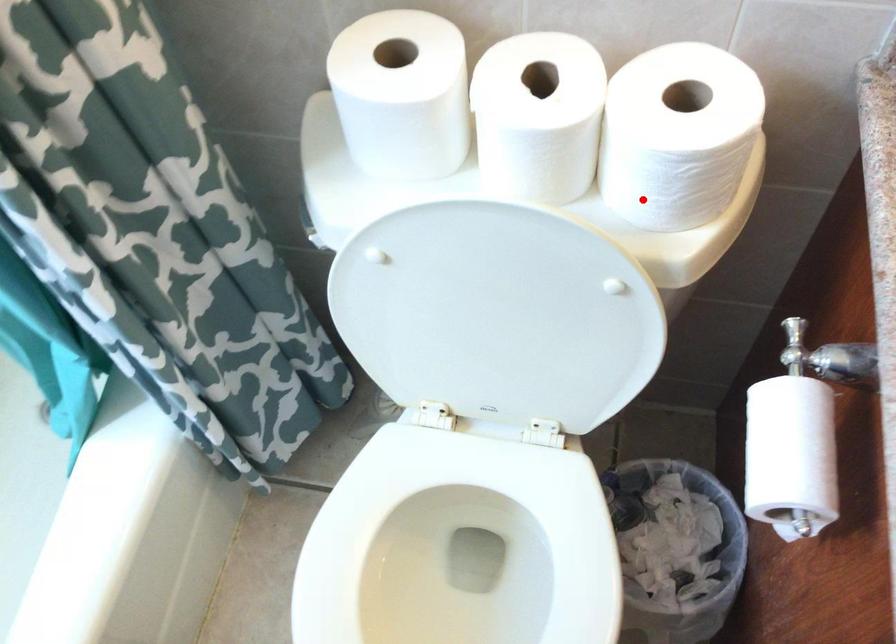
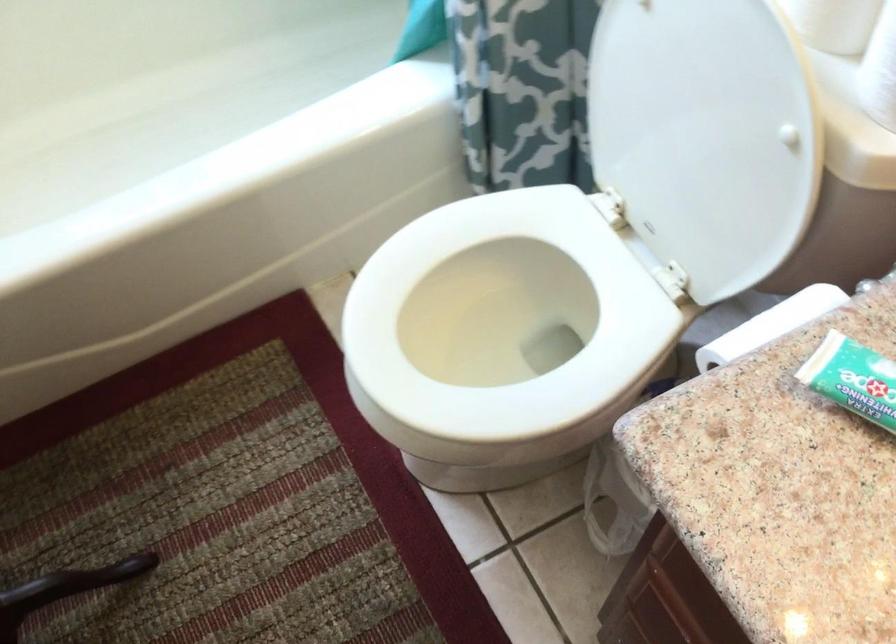
The point at the highlighted location is marked in the first image. Where is the corresponding point in the second image?

(880, 70)